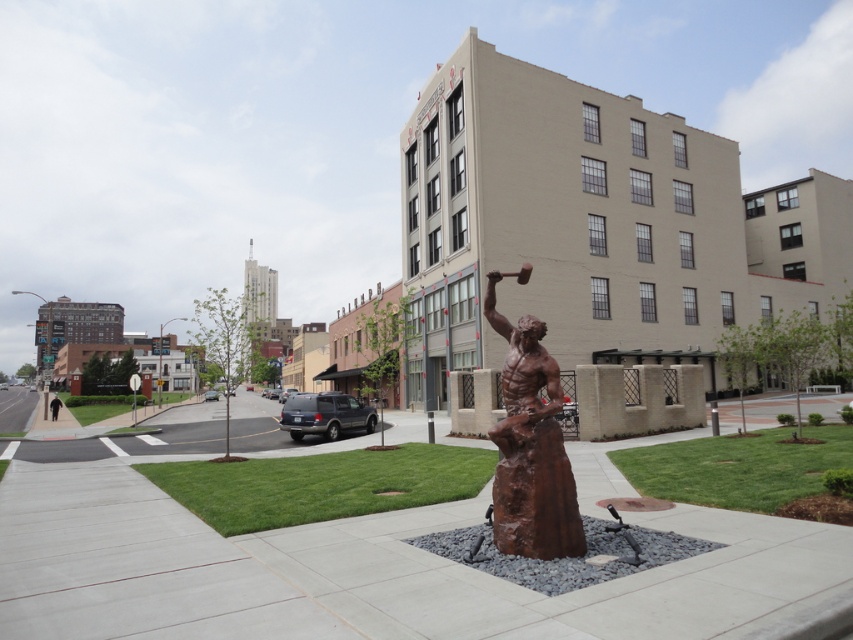
Who is positioned more to the left, rusty bronze statue at center or black fabric person at lower left?

black fabric person at lower left is more to the left.

Between rusty bronze statue at center and black fabric person at lower left, which one has more height?

Standing taller between the two is black fabric person at lower left.

Identify the location of rusty bronze statue at center. (531, 448).

Identify the location of rusty bronze statue at center. (531, 448).

Is smooth concrete pavement at center below rusty bronze statue at center?

Yes, smooth concrete pavement at center is below rusty bronze statue at center.

Is smooth concrete pavement at center wider than rusty bronze statue at center?

Indeed, smooth concrete pavement at center has a greater width compared to rusty bronze statue at center.

The height and width of the screenshot is (640, 853). What do you see at coordinates (372, 572) in the screenshot? I see `smooth concrete pavement at center` at bounding box center [372, 572].

Where is `smooth concrete pavement at center`? The image size is (853, 640). smooth concrete pavement at center is located at coordinates (372, 572).

Looking at this image, who is lower down, smooth concrete pavement at center or black fabric person at lower left?

black fabric person at lower left is lower down.

Does smooth concrete pavement at center have a lesser height compared to black fabric person at lower left?

Incorrect, smooth concrete pavement at center's height does not fall short of black fabric person at lower left's.

Find the location of `smooth concrete pavement at center`. smooth concrete pavement at center is located at coordinates (372, 572).